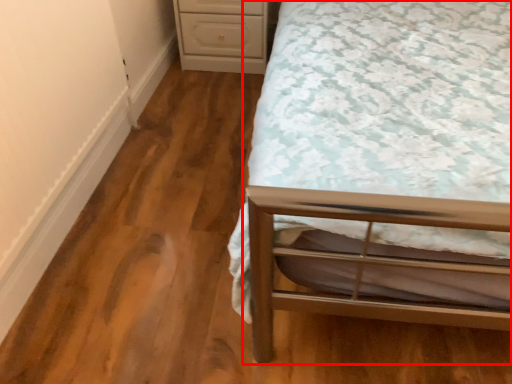
Question: Observing the image, what is the correct spatial positioning of bed (annotated by the red box) in reference to chest of drawers?

Choices:
 (A) right
 (B) left

Answer: (A)